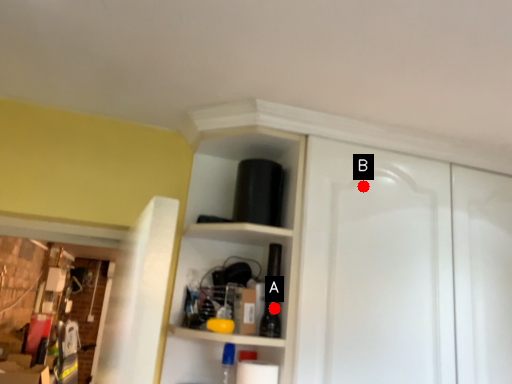
Question: Two points are circled on the image, labeled by A and B beside each circle. Which of the following is the farthest from the observer?

Choices:
 (A) A is further
 (B) B is further

Answer: (B)